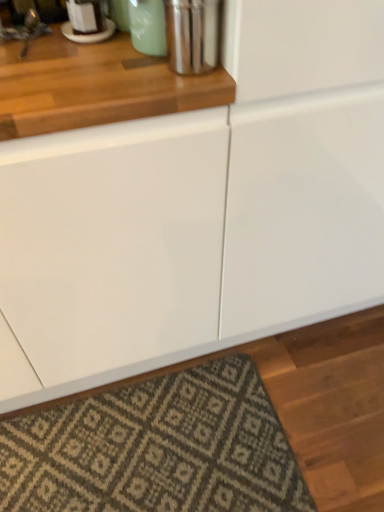
Question: From the image's perspective, does shiny metallic canister at upper center appear higher than textured beige rug at lower center?

Choices:
 (A) yes
 (B) no

Answer: (A)

Question: From the image's perspective, would you say shiny metallic canister at upper center is shown under textured beige rug at lower center?

Choices:
 (A) no
 (B) yes

Answer: (A)

Question: Is shiny metallic canister at upper center at the right side of textured beige rug at lower center?

Choices:
 (A) no
 (B) yes

Answer: (B)

Question: From a real-world perspective, does shiny metallic canister at upper center sit lower than textured beige rug at lower center?

Choices:
 (A) no
 (B) yes

Answer: (A)

Question: Is shiny metallic canister at upper center wider than textured beige rug at lower center?

Choices:
 (A) no
 (B) yes

Answer: (A)

Question: Can you confirm if shiny metallic canister at upper center is positioned to the left of textured beige rug at lower center?

Choices:
 (A) yes
 (B) no

Answer: (B)

Question: Is textured beige rug at lower center to the left of shiny metallic canister at upper center from the viewer's perspective?

Choices:
 (A) no
 (B) yes

Answer: (B)

Question: Is textured beige rug at lower center looking in the opposite direction of shiny metallic canister at upper center?

Choices:
 (A) yes
 (B) no

Answer: (B)

Question: Considering the relative sizes of textured beige rug at lower center and shiny metallic canister at upper center in the image provided, is textured beige rug at lower center thinner than shiny metallic canister at upper center?

Choices:
 (A) no
 (B) yes

Answer: (A)

Question: Is textured beige rug at lower center smaller than shiny metallic canister at upper center?

Choices:
 (A) yes
 (B) no

Answer: (B)

Question: Is the depth of textured beige rug at lower center less than that of shiny metallic canister at upper center?

Choices:
 (A) no
 (B) yes

Answer: (A)

Question: From the image's perspective, is textured beige rug at lower center located beneath shiny metallic canister at upper center?

Choices:
 (A) no
 (B) yes

Answer: (B)

Question: Choose the correct answer: Is textured beige rug at lower center inside shiny metallic canister at upper center or outside it?

Choices:
 (A) inside
 (B) outside

Answer: (B)